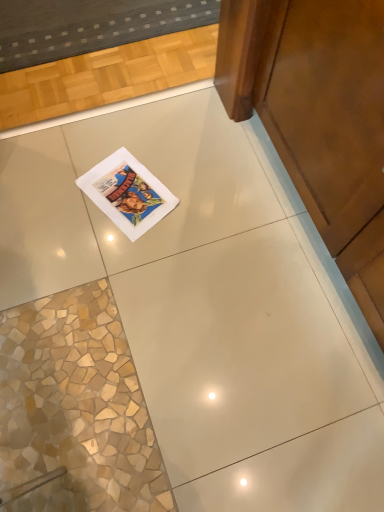
Where is `vacant area situated below matte paper magazine at center (from a real-world perspective)`? Image resolution: width=384 pixels, height=512 pixels. vacant area situated below matte paper magazine at center (from a real-world perspective) is located at coordinates (132, 193).